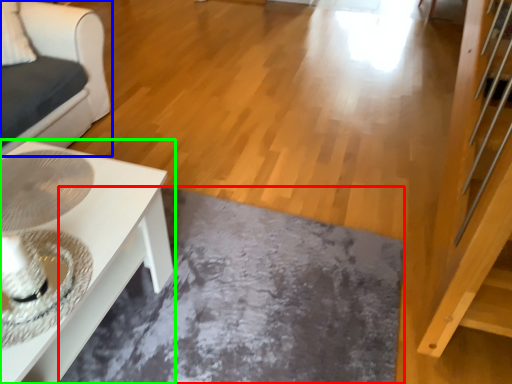
Question: Estimate the real-world distances between objects in this image. Which object is closer to slate (highlighted by a red box), furniture (highlighted by a blue box) or table (highlighted by a green box)?

Choices:
 (A) furniture
 (B) table

Answer: (B)